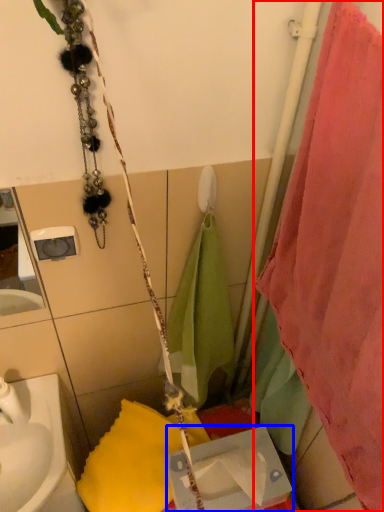
Question: Which object is closer to the camera taking this photo, curtain (highlighted by a red box) or box (highlighted by a blue box)?

Choices:
 (A) curtain
 (B) box

Answer: (A)